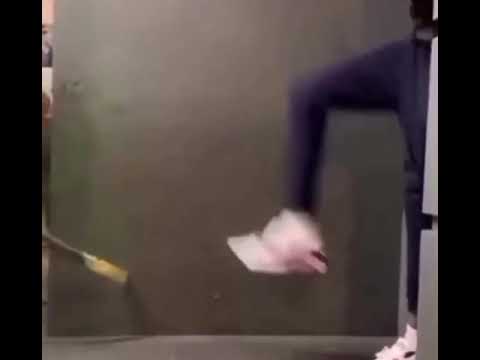
The image size is (480, 360). Identify the location of blurred wall. [x=251, y=125].